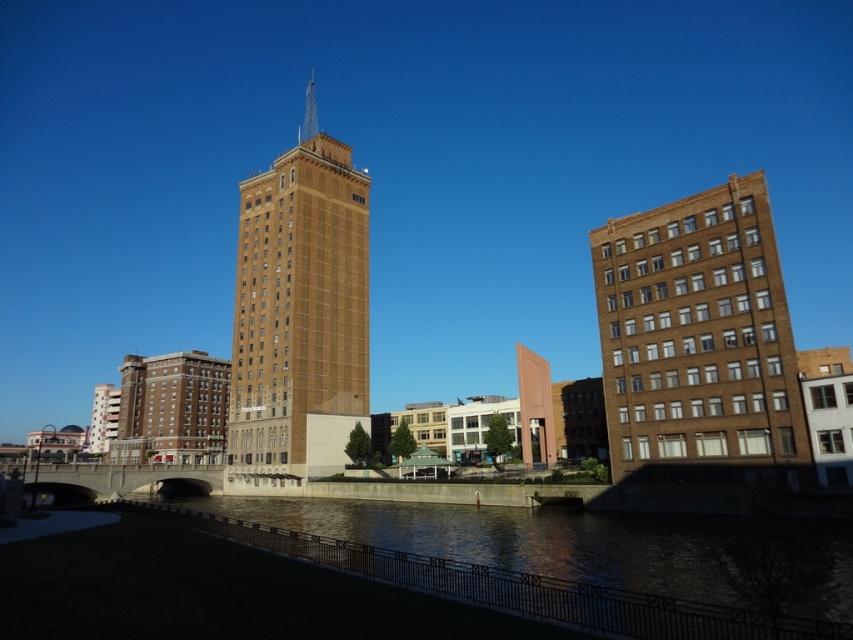
Question: Can you confirm if brown brick tower at center is wider than brown concrete river at lower center?

Choices:
 (A) yes
 (B) no

Answer: (B)

Question: Does brown brick building at right appear on the left side of brown concrete river at lower center?

Choices:
 (A) no
 (B) yes

Answer: (A)

Question: Based on their relative distances, which object is farther from the brown concrete river at lower center?

Choices:
 (A) brown brick building at right
 (B) brown brick tower at center

Answer: (B)

Question: Which object is the closest to the brown brick tower at center?

Choices:
 (A) brown brick building at right
 (B) brown concrete river at lower center

Answer: (B)

Question: Which point is farther from the camera taking this photo?

Choices:
 (A) (259, 540)
 (B) (347, 172)

Answer: (B)

Question: Is brown brick building at right to the left of brown concrete river at lower center from the viewer's perspective?

Choices:
 (A) no
 (B) yes

Answer: (A)